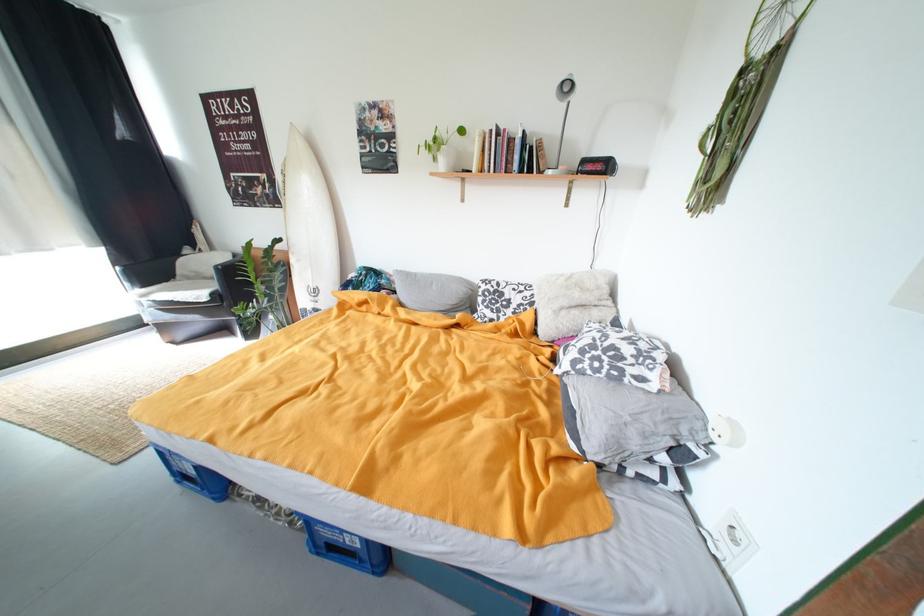
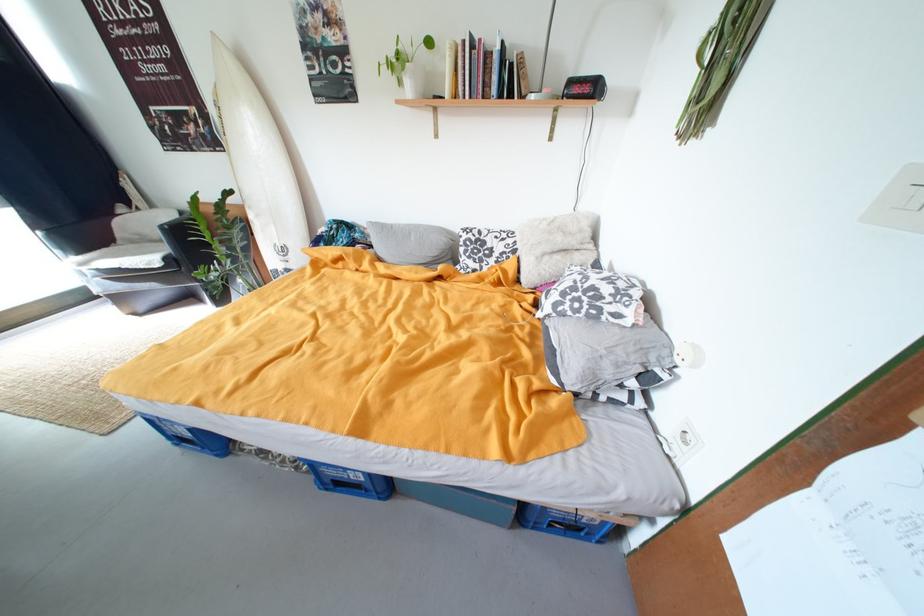
Find the pixel in the second image that matches point 557,174 in the first image.

(541, 99)